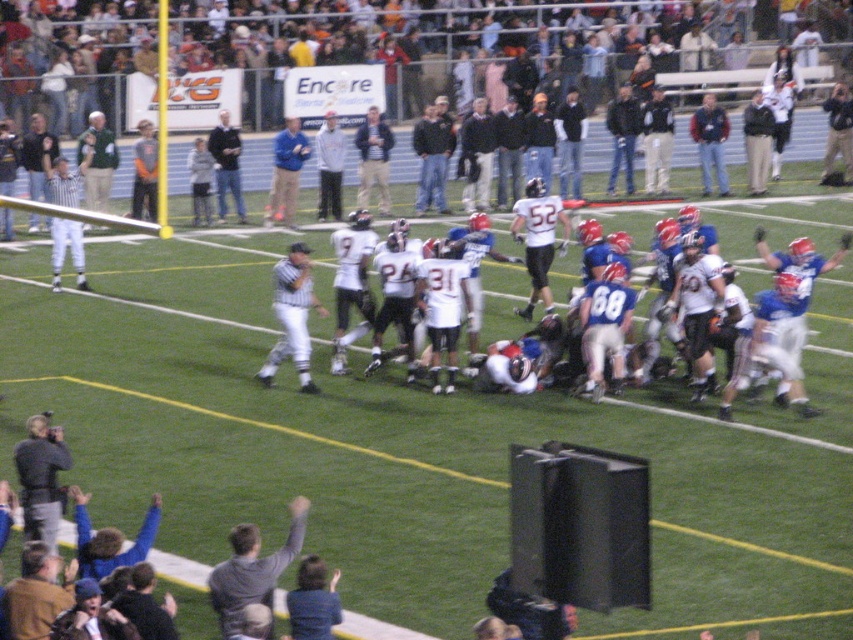
Between point (125, 49) and point (225, 148), which one is positioned behind?

Point (125, 49)

Between dark clothing at upper center and dark blue jacket at center, which one is positioned lower?

Positioned lower is dark blue jacket at center.

Where is `dark clothing at upper center`? This screenshot has width=853, height=640. dark clothing at upper center is located at coordinates (440, 56).

Between white jersey at center and white striped referee at left, which one is positioned lower?

white striped referee at left is below.

From the picture: Is white jersey at center to the left of white striped referee at left from the viewer's perspective?

In fact, white jersey at center is to the right of white striped referee at left.

At what (x,y) coordinates should I click in order to perform the action: click on white jersey at center. Please return your answer as a coordinate pair (x, y). The width and height of the screenshot is (853, 640). Looking at the image, I should click on (776, 227).

The image size is (853, 640). I want to click on white jersey at center, so click(776, 227).

Does blue denim jeans at center appear over dark blue jacket at center?

Yes, blue denim jeans at center is above dark blue jacket at center.

Which of these two, blue denim jeans at center or dark blue jacket at center, stands taller?

dark blue jacket at center

Where is `blue denim jeans at center`? The image size is (853, 640). blue denim jeans at center is located at coordinates (711, 141).